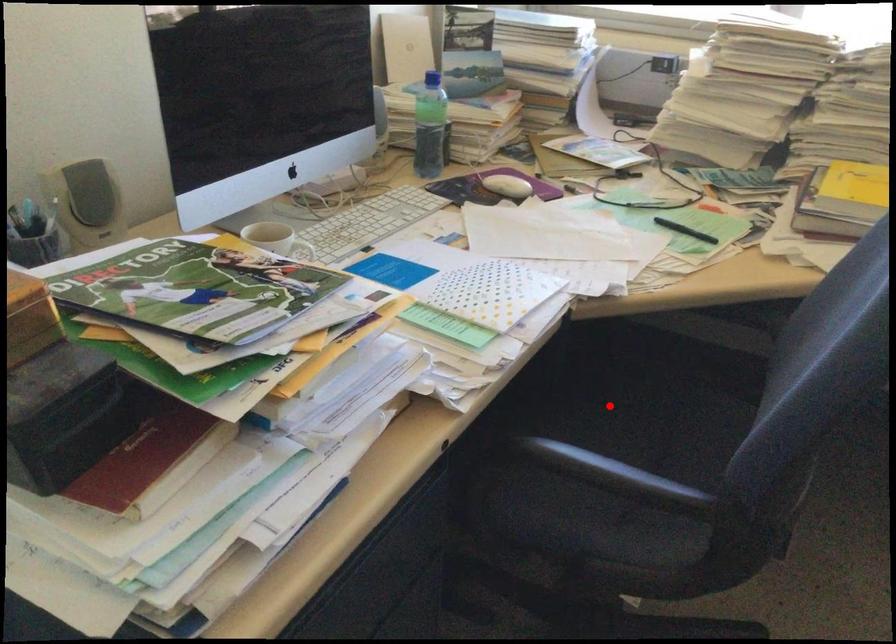
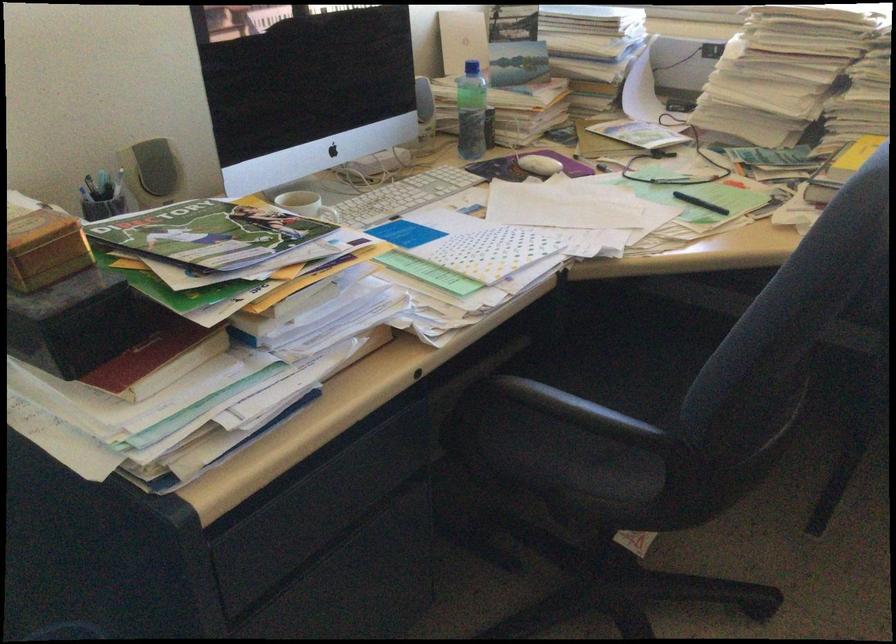
Locate, in the second image, the point that corresponds to the highlighted location in the first image.

(618, 365)